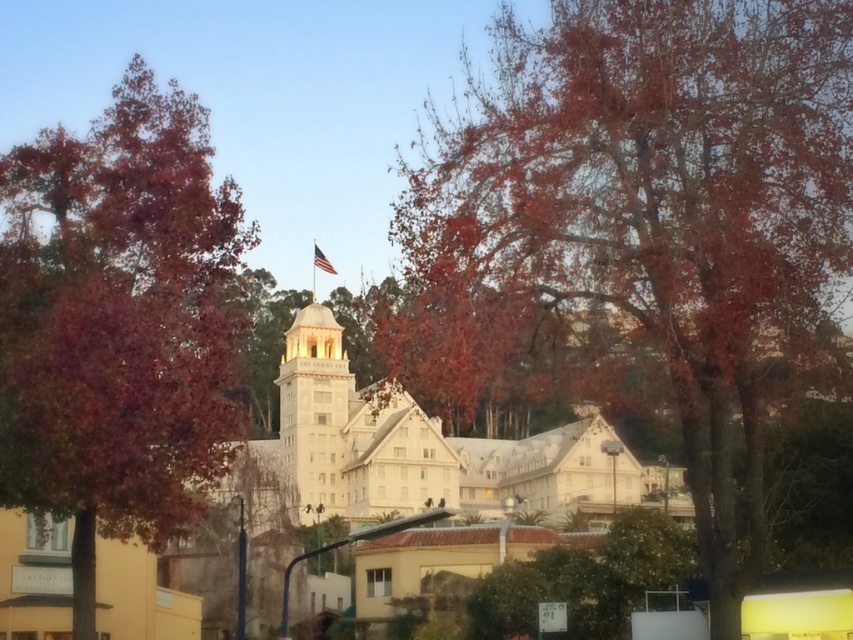
Question: Which point is farther to the camera?

Choices:
 (A) reddish-brown bark tree at center
 (B) white smooth tower at center
 (C) white fabric flag at center
 (D) reddish-brown textured leaves at left

Answer: (C)

Question: Does white smooth tower at center have a greater width compared to white fabric flag at center?

Choices:
 (A) yes
 (B) no

Answer: (A)

Question: Is reddish-brown bark tree at center behind reddish-brown textured leaves at left?

Choices:
 (A) no
 (B) yes

Answer: (B)

Question: Is reddish-brown bark tree at center to the left of reddish-brown textured leaves at left from the viewer's perspective?

Choices:
 (A) no
 (B) yes

Answer: (A)

Question: Which of the following is the closest to the observer?

Choices:
 (A) reddish-brown bark tree at center
 (B) reddish-brown textured leaves at left
 (C) white fabric flag at center

Answer: (B)

Question: Which object is the farthest from the white fabric flag at center?

Choices:
 (A) reddish-brown bark tree at center
 (B) reddish-brown textured leaves at left

Answer: (B)